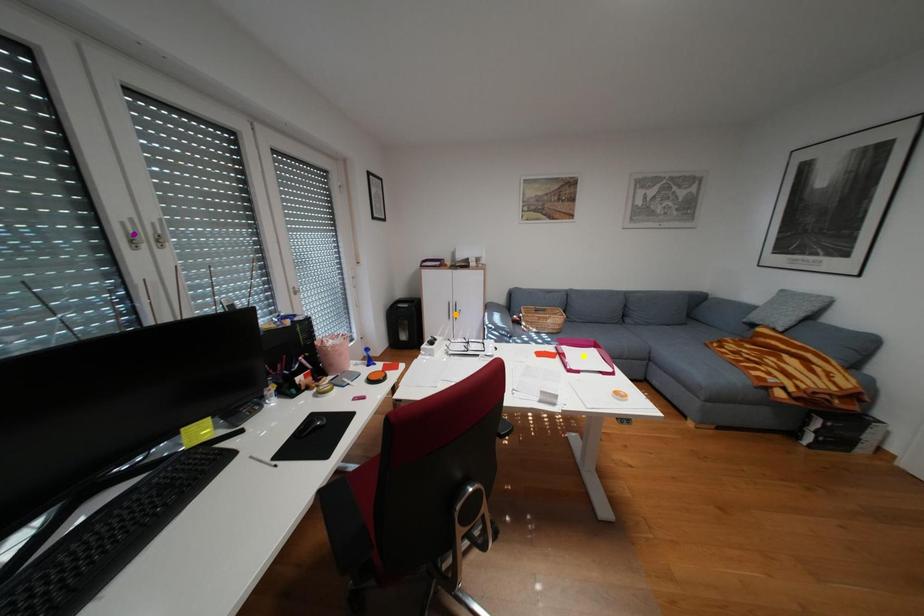
Order these from nearest to farthest:
A) purple point
B) orange point
C) yellow point

purple point, yellow point, orange point